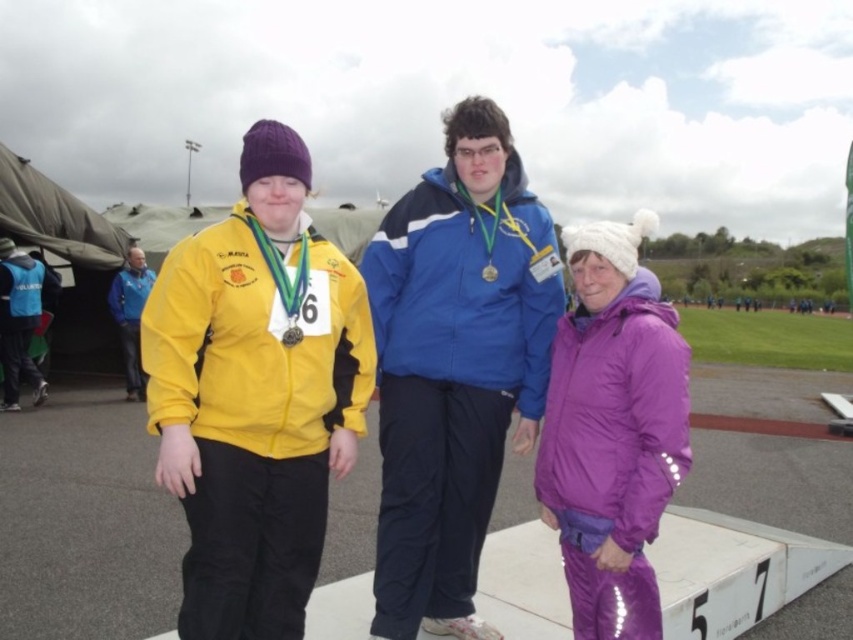
Question: Is blue fabric jacket at left above metallic gold medal at center?

Choices:
 (A) yes
 (B) no

Answer: (B)

Question: Which point is closer to the camera taking this photo?

Choices:
 (A) (10, 410)
 (B) (126, 317)

Answer: (A)

Question: Does purple synthetic jacket at center have a larger size compared to blue reflective vest at left?

Choices:
 (A) yes
 (B) no

Answer: (A)

Question: Does purple synthetic jacket at center lie behind blue fabric jacket at left?

Choices:
 (A) no
 (B) yes

Answer: (A)

Question: Among these points, which one is farthest from the camera?

Choices:
 (A) (412, 593)
 (B) (560, 342)

Answer: (B)

Question: Which point is farther to the camera?

Choices:
 (A) (560, 426)
 (B) (386, 449)
 (C) (4, 253)

Answer: (C)